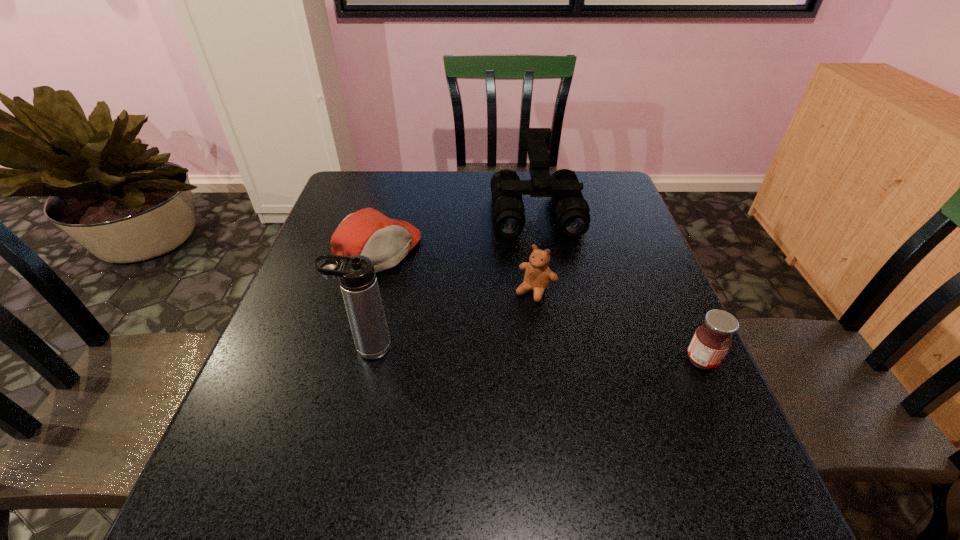
What are the coordinates of `free space between the third nearest object and the cap` in the screenshot? It's located at (458, 270).

Find the location of a particular element. This screenshot has height=540, width=960. free area in between the thermos bottle and the jam is located at coordinates (534, 354).

The height and width of the screenshot is (540, 960). What are the coordinates of `free spot between the binoculars and the rightmost object` in the screenshot? It's located at (618, 285).

Find the location of a particular element. This screenshot has height=540, width=960. free point between the tallest object and the second tallest object is located at coordinates (451, 279).

Locate an element on the screen. The image size is (960, 540). free point between the binoculars and the thermos bottle is located at coordinates (451, 279).

Locate an element on the screen. This screenshot has width=960, height=540. free space between the tallest object and the teddy bear is located at coordinates (451, 319).

Identify which object is the nearest to the thermos bottle. Please provide its 2D coordinates. Your answer should be formatted as a tuple, i.e. [(x, y)], where the tuple contains the x and y coordinates of a point satisfying the conditions above.

[(367, 232)]

At what (x,y) coordinates should I click in order to perform the action: click on the fourth closest object to the thermos bottle. Please return your answer as a coordinate pair (x, y). Looking at the image, I should click on (711, 341).

Where is `free space that satisfies the following two spatial constraints: 1. on the front side of the jam; 2. on the label side of the cap`? free space that satisfies the following two spatial constraints: 1. on the front side of the jam; 2. on the label side of the cap is located at coordinates (349, 360).

Where is `free space that satisfies the following two spatial constraints: 1. on the front side of the jam; 2. on the label side of the cap`? The width and height of the screenshot is (960, 540). free space that satisfies the following two spatial constraints: 1. on the front side of the jam; 2. on the label side of the cap is located at coordinates (349, 360).